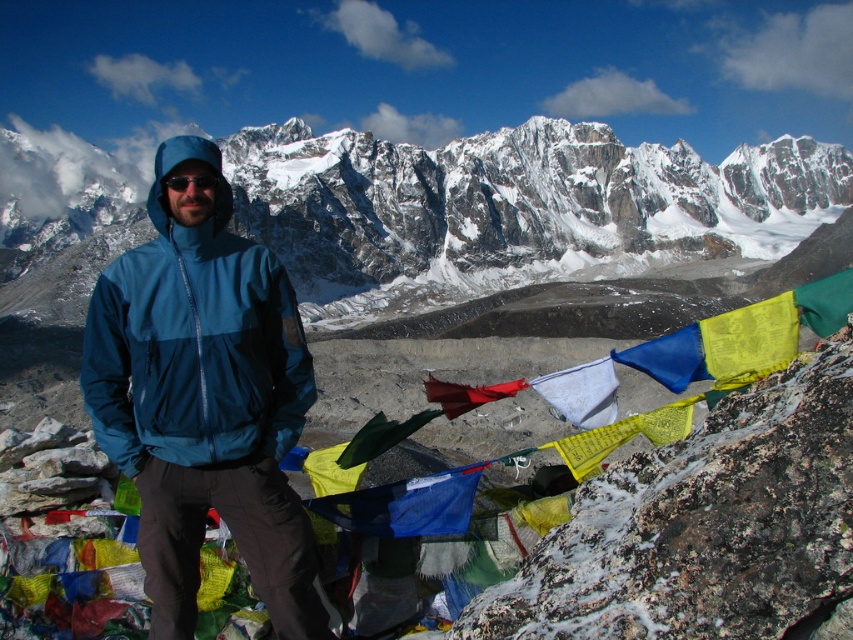
You are a hiker who wants to take a photo of the red fabric flag at center while also including the blue waterproof jacket at center in the frame. Since both are at the center, will you need to adjust your camera angle upwards or downwards to include both?

The blue waterproof jacket at center is located above the red fabric flag at center. To include both in the frame, you would need to adjust your camera angle downwards to capture the lower position of the red fabric flag at center while still including the higher blue waterproof jacket at center.

You are hiking and want to place a small marker between the textured rock at center and the red fabric flag at center. Which object should you place the marker closer to if you want it to be nearer to the foreground?

You should place the marker closer to the textured rock at center because it is closer to the viewer than the red fabric flag at center, making it part of the foreground.

You are a hiker who wants to locate your friend wearing a matte blue jacket at center. According to the map coordinates, where should you look to find them?

Your friend wearing the matte blue jacket at center is located at point [508,209].